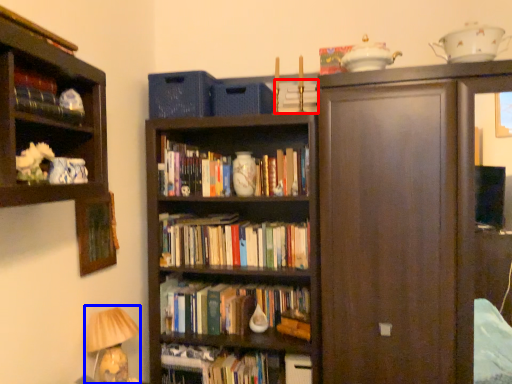
Question: Which point is closer to the camera, book (highlighted by a red box) or table lamp (highlighted by a blue box)?

Choices:
 (A) book
 (B) table lamp

Answer: (B)